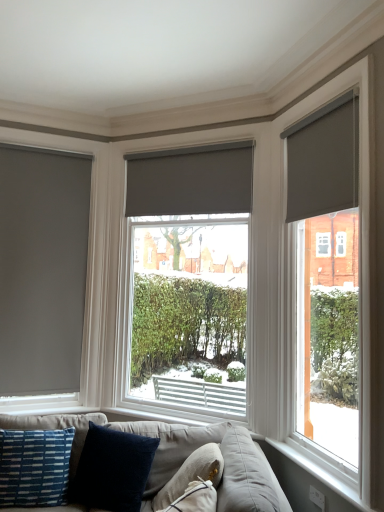
Question: In terms of size, does matte gray roller blind at center, the first window blind positioned from the back, appear bigger or smaller than white plastic window sill at lower right?

Choices:
 (A) big
 (B) small

Answer: (A)

Question: From the image's perspective, is matte gray roller blind at center, the second window blind positioned from the right, above or below white plastic window sill at lower right?

Choices:
 (A) above
 (B) below

Answer: (A)

Question: Which object is the closest to the white plastic window sill at lower right?

Choices:
 (A) matte gray roller blind at center, marked as the 2th window in a right-to-left arrangement
 (B) matte gray roller blind at upper right, which is the 1th window blind in right-to-left order
 (C) velvety dark blue pillow at lower center, placed as the 3th pillow when sorted from right to left
 (D) matte gray roller blind at right, marked as the first window in a right-to-left arrangement
 (E) blue woven pillow at lower left, the fourth pillow viewed from the right

Answer: (D)

Question: Based on their relative distances, which object is nearer to the blue woven pillow at lower left, the fourth pillow viewed from the right?

Choices:
 (A) velvety dark blue pillow at lower center, the second pillow positioned from the left
 (B) matte gray roller blind at center, the first window blind positioned from the back
 (C) matte gray roller blind at upper right, marked as the 2th window blind in a back-to-front arrangement
 (D) matte gray blind at left, positioned as the 3th window in right-to-left order
 (E) matte gray roller blind at right, marked as the first window in a right-to-left arrangement

Answer: (A)